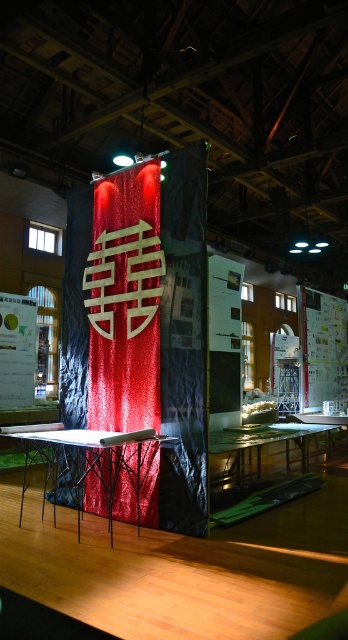
You are an event planner setting up for a gala. You need to decide whether to place a 3D sculpture on the metallic silver table at center. However, there is a shiny sequined curtain at center already on it. Can the sculpture be placed on the table without moving the curtain?

The shiny sequined curtain at center is positioned over metallic silver table at center, so the curtain is currently occupying the table. Therefore, you would need to move the curtain to place the sculpture on the metallic silver table at center.

You are standing in the exhibition space and looking at the banner with the white character. There are two points marked on the banner. Which point is closer to you, point (96, 353) or point (241, 449)?

Point (96, 353) is closer to the camera than point (241, 449).

You are an event planner setting up a photo booth in the exhibition space. You need to place two markers at the coordinates point (138,392) and point (81,509). Which marker should you place first to ensure the one in front is visible?

You should place the marker at point (138,392) first because it is in front of point (81,509), ensuring visibility.